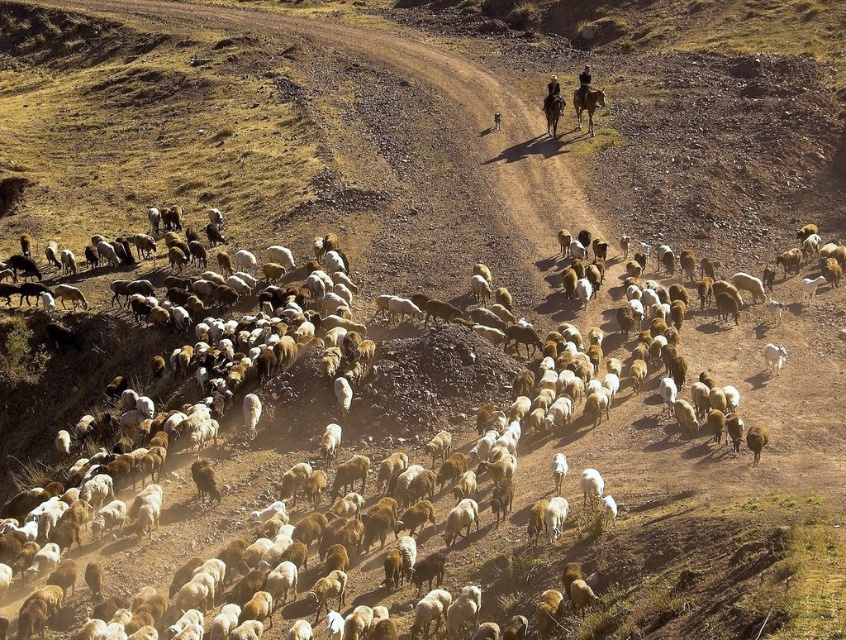
Which is behind, point (558, 88) or point (580, 81)?

Point (580, 81)

Who is positioned more to the right, brown leather jacket at center or dark brown leather jacket at upper center?

From the viewer's perspective, dark brown leather jacket at upper center appears more on the right side.

Is point (548, 104) more distant than point (581, 100)?

That is False.

At what (x,y) coordinates should I click in order to perform the action: click on brown leather jacket at center. Please return your answer as a coordinate pair (x, y). This screenshot has height=640, width=846. Looking at the image, I should click on (551, 92).

Measure the distance between white woolly sheep at center and camera.

white woolly sheep at center and camera are 30.00 meters apart.

Can you confirm if white woolly sheep at center is positioned above dark brown leather jacket at upper center?

Actually, white woolly sheep at center is below dark brown leather jacket at upper center.

Is point (801, 419) behind point (578, 83)?

No, (801, 419) is in front of (578, 83).

Identify the location of white woolly sheep at center. This screenshot has height=640, width=846. (706, 442).

Is point (584, 109) positioned behind point (542, 106)?

Yes, it is behind point (542, 106).

Who is lower down, brown glossy horse at upper center or brown leather jacket at center?

Positioned lower is brown glossy horse at upper center.

Is point (581, 84) positioned in front of point (548, 92)?

That is True.

Locate an element on the screen. This screenshot has width=846, height=640. brown glossy horse at upper center is located at coordinates (586, 104).